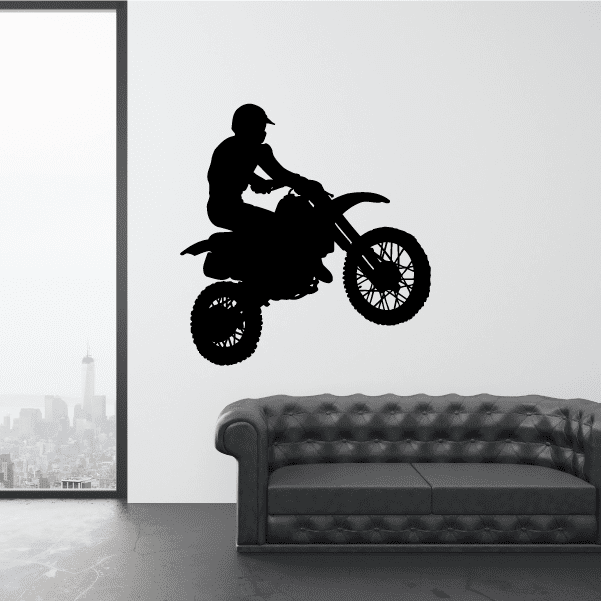
Locate an element on the screen. black window frame is located at coordinates (123, 314), (53, 5), (47, 495).